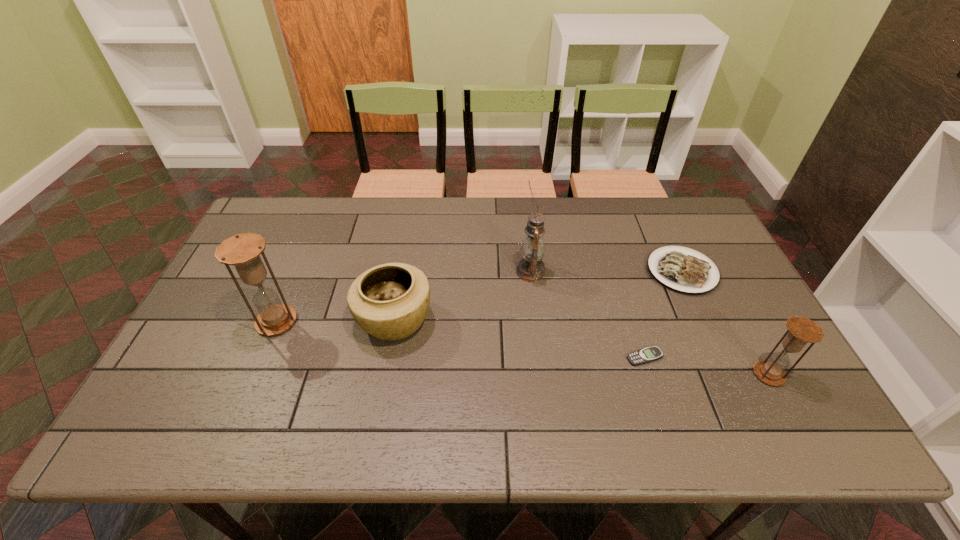
Locate an element on the screen. Image resolution: width=960 pixels, height=540 pixels. plate that is at the right edge is located at coordinates (684, 272).

Identify the location of object present at the near right corner. (802, 330).

Identify the location of vacant space at the far edge of the desktop. (342, 226).

The image size is (960, 540). In the image, there is a desktop. In order to click on free region at the near edge in this screenshot , I will do `click(463, 399)`.

Locate an element on the screen. The height and width of the screenshot is (540, 960). vacant space at the left edge of the desktop is located at coordinates (198, 338).

The image size is (960, 540). What are the coordinates of `free space at the right edge of the desktop` in the screenshot? It's located at (731, 306).

Locate an element on the screen. The height and width of the screenshot is (540, 960). vacant space that's between the plate and the leftmost object is located at coordinates (479, 296).

The image size is (960, 540). Identify the location of free space between the oil lamp and the third shortest object. (463, 296).

What are the coordinates of `free area in between the plate and the farther hourglass` in the screenshot? It's located at (479, 296).

At what (x,y) coordinates should I click in order to perform the action: click on empty space between the shortest object and the third object from left to right. Please return your answer as a coordinate pair (x, y). The height and width of the screenshot is (540, 960). Looking at the image, I should click on (588, 315).